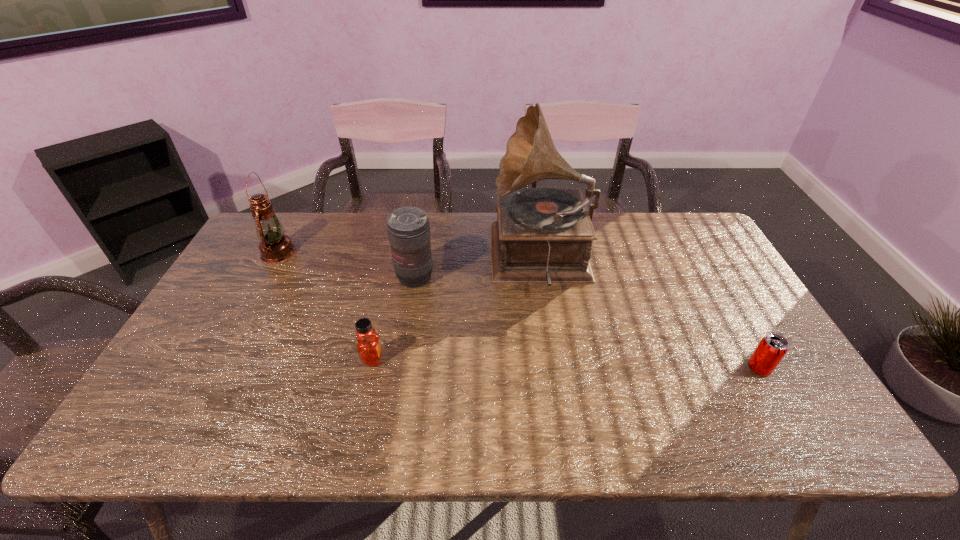
This screenshot has height=540, width=960. I want to click on free space between the second shortest object and the shortest object, so click(x=565, y=363).

The height and width of the screenshot is (540, 960). I want to click on vacant area between the honey and the telephoto lens, so click(x=394, y=318).

Image resolution: width=960 pixels, height=540 pixels. Identify the location of empty location between the fourth tallest object and the tallest object. (457, 308).

I want to click on free spot between the telephoto lens and the shortest object, so tap(587, 323).

Locate an element on the screen. This screenshot has width=960, height=540. vacant area that lies between the second shortest object and the telephoto lens is located at coordinates (394, 318).

Identify the location of object that is the second closest to the second object from right to left. (368, 345).

Find the location of a particular element. The height and width of the screenshot is (540, 960). object that is the second closest to the third shortest object is located at coordinates (368, 345).

Find the location of `free location that satisfies the following two spatial constraints: 1. on the side of the third shortest object where the control switches are located; 2. on the left side of the rightmost object`. free location that satisfies the following two spatial constraints: 1. on the side of the third shortest object where the control switches are located; 2. on the left side of the rightmost object is located at coordinates (400, 369).

Find the location of a particular element. The image size is (960, 540). free spot that satisfies the following two spatial constraints: 1. on the side of the soda can where the control switches are located; 2. on the right side of the third shortest object is located at coordinates (400, 369).

Where is `free space that satisfies the following two spatial constraints: 1. on the back side of the rightmost object; 2. from the horn of the second object from right to left`? The height and width of the screenshot is (540, 960). free space that satisfies the following two spatial constraints: 1. on the back side of the rightmost object; 2. from the horn of the second object from right to left is located at coordinates (696, 258).